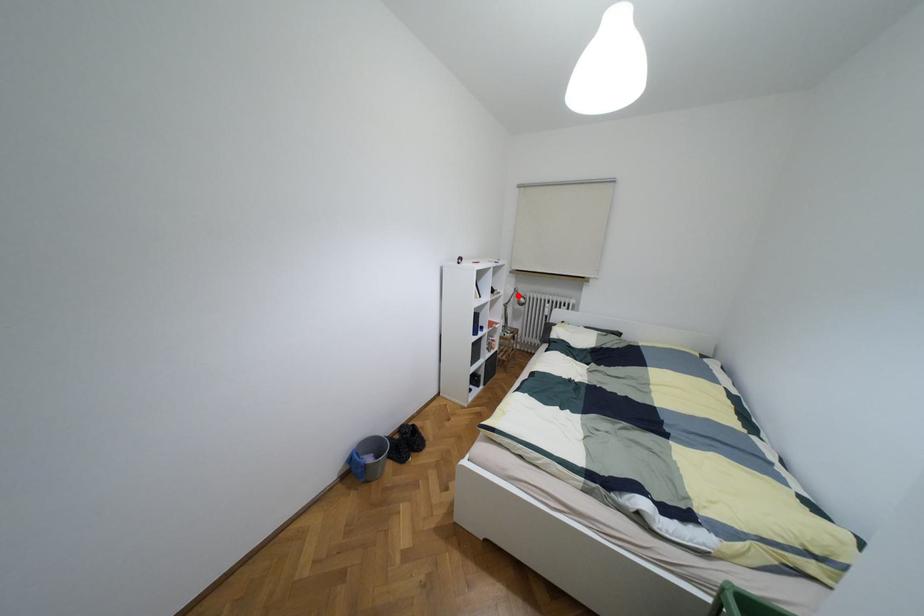
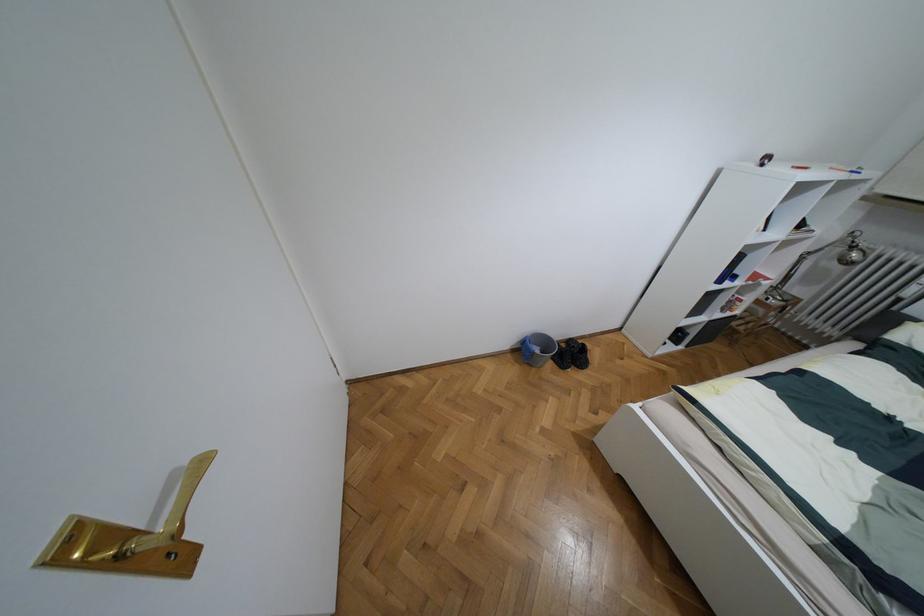
Question: I am providing you with two images of the same scene from different viewpoints. A red point is shown in image1. For the corresponding object point in image2, is it positioned nearer or farther from the camera?

Choices:
 (A) Nearer
 (B) Farther

Answer: (B)